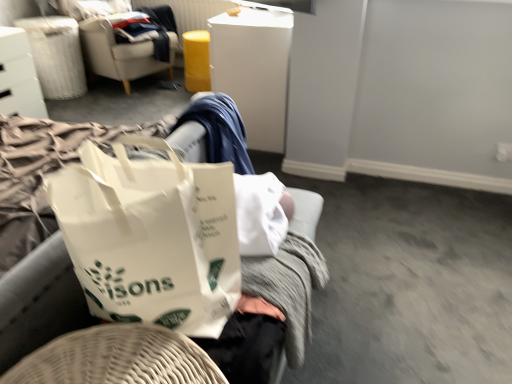
Question: Should I look upward or downward to see white plastic file cabinet at upper center?

Choices:
 (A) down
 (B) up

Answer: (B)

Question: From a real-world perspective, does beige fabric chair at upper left sit lower than white glossy drawer at upper left, which is the 1th furniture from top to bottom?

Choices:
 (A) no
 (B) yes

Answer: (A)

Question: Considering the relative sizes of beige fabric chair at upper left and white glossy drawer at upper left, arranged as the 2th furniture when ordered from the bottom, in the image provided, is beige fabric chair at upper left wider than white glossy drawer at upper left, arranged as the 2th furniture when ordered from the bottom,?

Choices:
 (A) no
 (B) yes

Answer: (B)

Question: Is beige fabric chair at upper left far from white glossy drawer at upper left, the first furniture positioned from the back?

Choices:
 (A) yes
 (B) no

Answer: (B)

Question: Is beige fabric chair at upper left in contact with white glossy drawer at upper left, arranged as the 2th furniture when ordered from the bottom?

Choices:
 (A) yes
 (B) no

Answer: (B)

Question: Is beige fabric chair at upper left positioned behind white glossy drawer at upper left, which appears as the 1th furniture when viewed from the left?

Choices:
 (A) no
 (B) yes

Answer: (B)

Question: Considering the relative sizes of beige fabric chair at upper left and white glossy drawer at upper left, arranged as the 2th furniture when viewed from the front, in the image provided, is beige fabric chair at upper left taller than white glossy drawer at upper left, arranged as the 2th furniture when viewed from the front,?

Choices:
 (A) yes
 (B) no

Answer: (A)

Question: Is white fabric laundry basket at upper left to the right of white plastic file cabinet at upper center from the viewer's perspective?

Choices:
 (A) yes
 (B) no

Answer: (B)

Question: Is white fabric laundry basket at upper left taller than white plastic file cabinet at upper center?

Choices:
 (A) yes
 (B) no

Answer: (B)

Question: Does white fabric laundry basket at upper left have a larger size compared to white plastic file cabinet at upper center?

Choices:
 (A) yes
 (B) no

Answer: (B)

Question: Is white plastic file cabinet at upper center located within white fabric laundry basket at upper left?

Choices:
 (A) yes
 (B) no

Answer: (B)

Question: Does white fabric laundry basket at upper left turn towards white plastic file cabinet at upper center?

Choices:
 (A) no
 (B) yes

Answer: (B)

Question: From the image's perspective, is white fabric laundry basket at upper left on white plastic file cabinet at upper center?

Choices:
 (A) yes
 (B) no

Answer: (A)

Question: Is white plastic file cabinet at upper center at the right side of white glossy drawer at upper left, which is the 1th furniture from top to bottom?

Choices:
 (A) yes
 (B) no

Answer: (A)